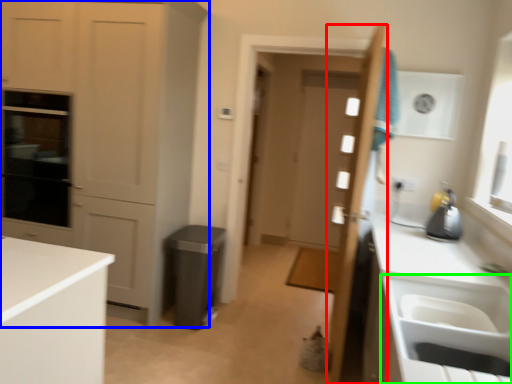
Question: Which object is positioned farthest from door (highlighted by a red box)? Select from cabinetry (highlighted by a blue box) and sink (highlighted by a green box).

Choices:
 (A) cabinetry
 (B) sink

Answer: (A)